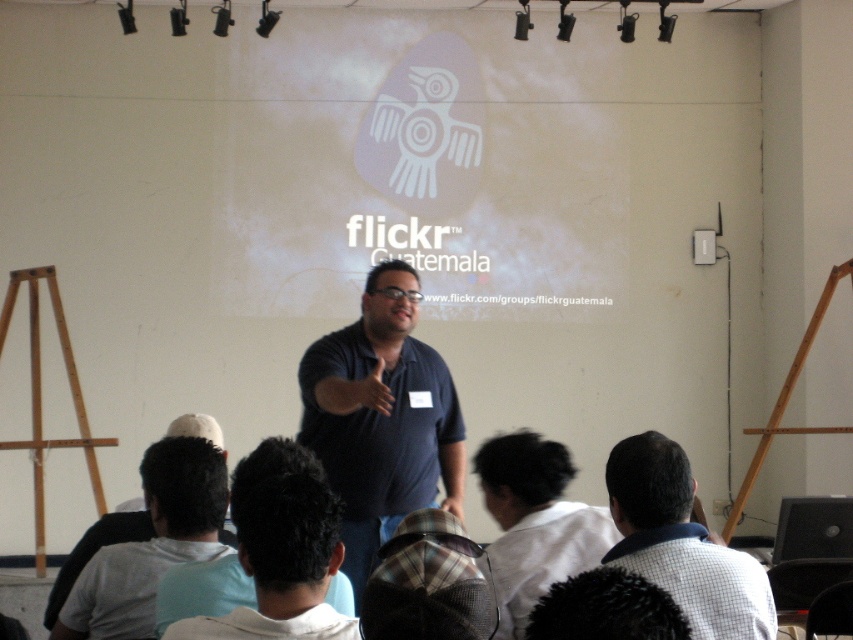
Question: Observing the image, what is the correct spatial positioning of bare wood easel at left in reference to wooden easel at right?

Choices:
 (A) left
 (B) right

Answer: (A)

Question: Among these points, which one is farthest from the camera?

Choices:
 (A) (618, 524)
 (B) (438, 371)

Answer: (B)

Question: Among these objects, which one is farthest from the camera?

Choices:
 (A) bare wood easel at left
 (B) white cotton shirt at lower center

Answer: (A)

Question: Which point is farther to the camera?

Choices:
 (A) tap(42, 540)
 (B) tap(762, 442)
 (C) tap(639, 436)

Answer: (B)

Question: From the image, what is the correct spatial relationship of dark blue shirt at center in relation to wooden easel at right?

Choices:
 (A) right
 (B) left

Answer: (B)

Question: Is white cotton shirt at lower center positioned in front of bare wood easel at left?

Choices:
 (A) yes
 (B) no

Answer: (A)